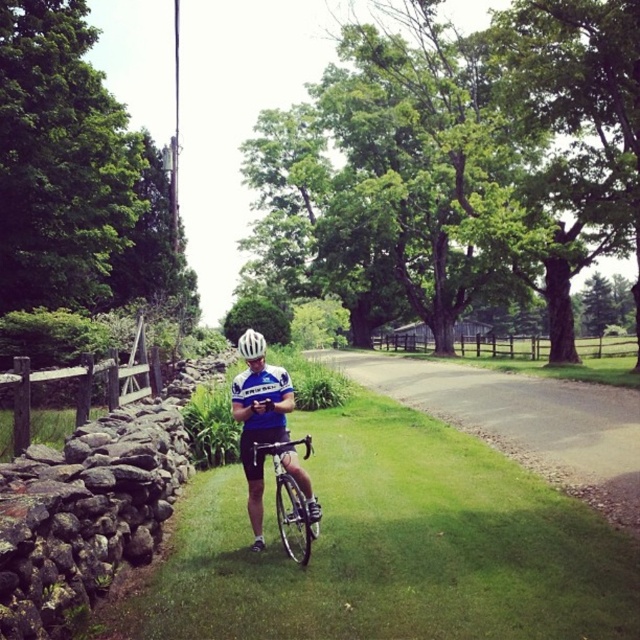
Which is more to the right, gravel road at center or blue jersey at center?

gravel road at center is more to the right.

Can you confirm if gravel road at center is wider than blue jersey at center?

Yes.

Is point (580, 381) positioned before point (284, 388)?

No.

I want to click on gravel road at center, so click(x=515, y=413).

How much distance is there between gravel road at center and white matte bicycle helmet at center?

They are 7.17 meters apart.

Is point (340, 360) farther from viewer compared to point (250, 346)?

Yes, point (340, 360) is behind point (250, 346).

I want to click on gravel road at center, so click(x=515, y=413).

Which is above, gravel road at center or silver metallic bicycle at center?

Positioned higher is silver metallic bicycle at center.

Image resolution: width=640 pixels, height=640 pixels. What are the coordinates of `gravel road at center` in the screenshot? It's located at (515, 413).